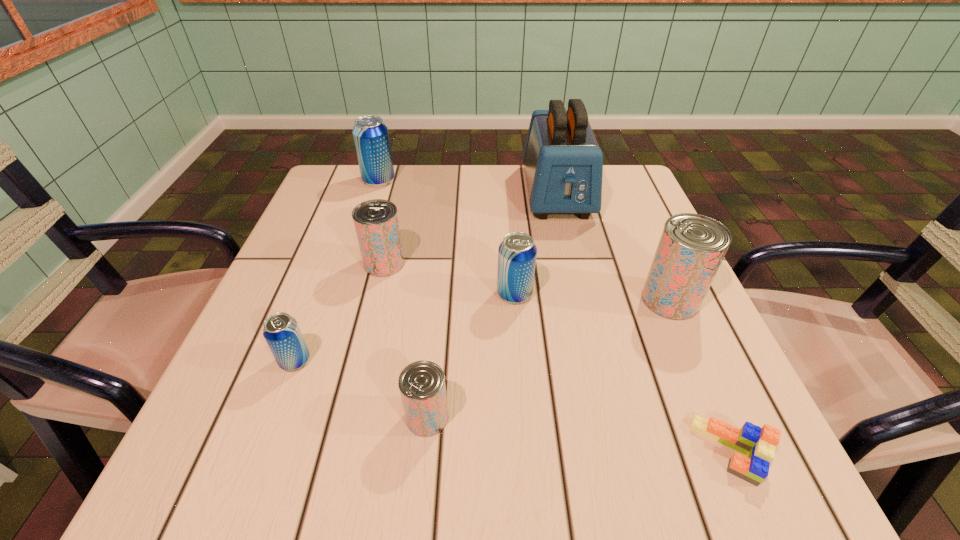
Where is `the third object from right to left`? the third object from right to left is located at coordinates (563, 162).

Where is `toaster`? toaster is located at coordinates (x=563, y=162).

Where is `the farthest blue beer can`? The height and width of the screenshot is (540, 960). the farthest blue beer can is located at coordinates (371, 137).

The width and height of the screenshot is (960, 540). In order to click on the farthest beer can in this screenshot , I will do `click(371, 137)`.

Image resolution: width=960 pixels, height=540 pixels. What are the coordinates of `the biggest red beer can` in the screenshot? It's located at (691, 248).

I want to click on the rightmost red beer can, so click(x=691, y=248).

Find the location of a particular element. This screenshot has height=540, width=960. the fifth nearest beer can is located at coordinates (376, 223).

Locate an element on the screen. the farthest red beer can is located at coordinates (376, 223).

Locate an element on the screen. The height and width of the screenshot is (540, 960). the fourth object from right to left is located at coordinates (517, 253).

You are a GUI agent. You are given a task and a screenshot of the screen. Output one action in this format:
    pyautogui.click(x=<x>, y=<y>)
    Task: Click on the fifth beer can from left to right
    This screenshot has width=960, height=540.
    Given the screenshot: What is the action you would take?
    pyautogui.click(x=517, y=253)